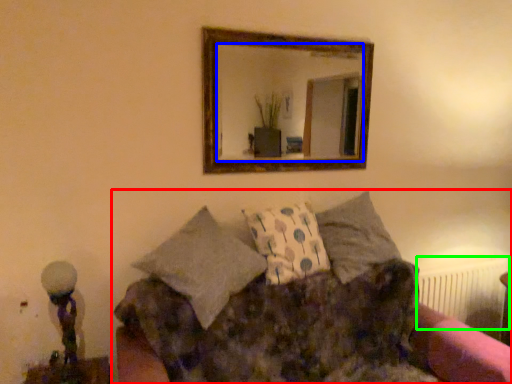
Question: Based on their relative distances, which object is farther from studio couch (highlighted by a red box)? Choose from mirror (highlighted by a blue box) and radiator (highlighted by a green box).

Choices:
 (A) mirror
 (B) radiator

Answer: (A)